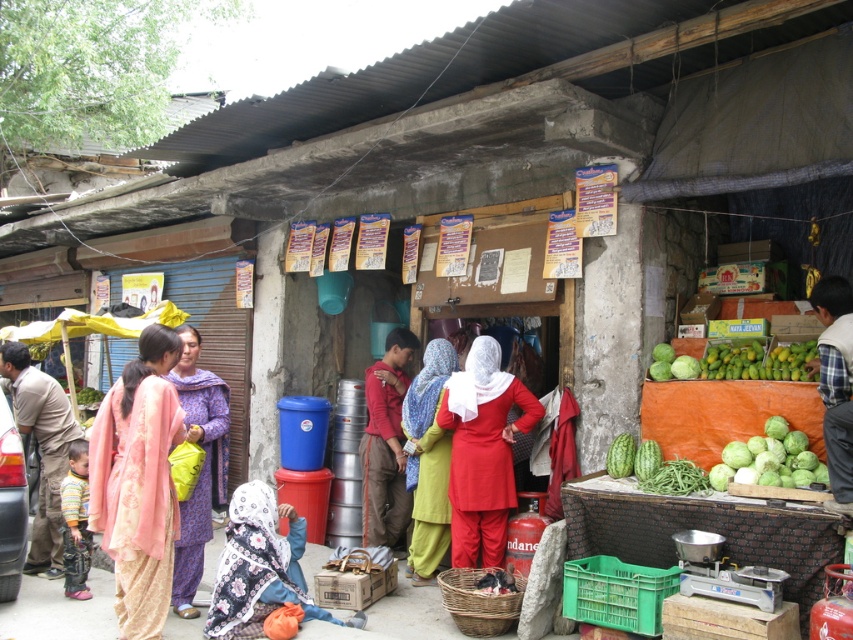
You are a customer at the market and want to buy the green matte cabbage at lower right. You are currently standing in front of the matte red dress at center. Can you reach the cabbage without moving past the dress?

The matte red dress at center is further to the viewer than green matte cabbage at lower right, so you would need to move past the dress to reach the cabbage.

You are a customer at the market and want to approach both the purple fabric dress at center and the plaid shirt at right. Which one should you walk towards first if you want to visit them in order from left to right?

The purple fabric dress at center is to the left of the plaid shirt at right, so you should walk towards the purple fabric dress at center first to follow the left to right order.

You are standing at the entrance of the market stall and want to move towards the back of the stall. Which point, point (198, 388) or point (704, 481), should you walk towards?

You should walk towards point (198, 388) because it is behind point (704, 481), which is closer to the entrance.